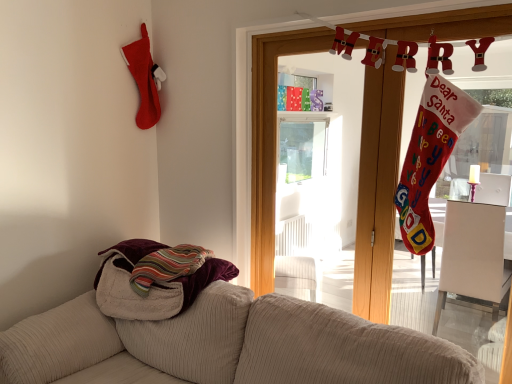
Question: Is striped cotton towel at lower left surrounding wooden door at upper center?

Choices:
 (A) no
 (B) yes

Answer: (A)

Question: From a real-world perspective, is striped cotton towel at lower left under wooden door at upper center?

Choices:
 (A) no
 (B) yes

Answer: (B)

Question: From a real-world perspective, is striped cotton towel at lower left located higher than wooden door at upper center?

Choices:
 (A) yes
 (B) no

Answer: (B)

Question: Is the position of striped cotton towel at lower left less distant than that of wooden door at upper center?

Choices:
 (A) no
 (B) yes

Answer: (A)

Question: From the image's perspective, is striped cotton towel at lower left located above wooden door at upper center?

Choices:
 (A) no
 (B) yes

Answer: (A)

Question: Is striped cotton towel at lower left at the left side of wooden door at upper center?

Choices:
 (A) no
 (B) yes

Answer: (B)

Question: From the image's perspective, is beige corduroy couch at lower left below wooden door at upper center?

Choices:
 (A) yes
 (B) no

Answer: (A)

Question: Is beige corduroy couch at lower left positioned far away from wooden door at upper center?

Choices:
 (A) yes
 (B) no

Answer: (B)

Question: Is wooden door at upper center inside beige corduroy couch at lower left?

Choices:
 (A) no
 (B) yes

Answer: (A)

Question: Considering the relative sizes of beige corduroy couch at lower left and wooden door at upper center in the image provided, is beige corduroy couch at lower left smaller than wooden door at upper center?

Choices:
 (A) no
 (B) yes

Answer: (A)

Question: Is beige corduroy couch at lower left at the left side of wooden door at upper center?

Choices:
 (A) no
 (B) yes

Answer: (B)

Question: Does beige corduroy couch at lower left have a greater width compared to wooden door at upper center?

Choices:
 (A) no
 (B) yes

Answer: (B)

Question: Can you confirm if wooden door at upper center is taller than beige corduroy couch at lower left?

Choices:
 (A) no
 (B) yes

Answer: (B)